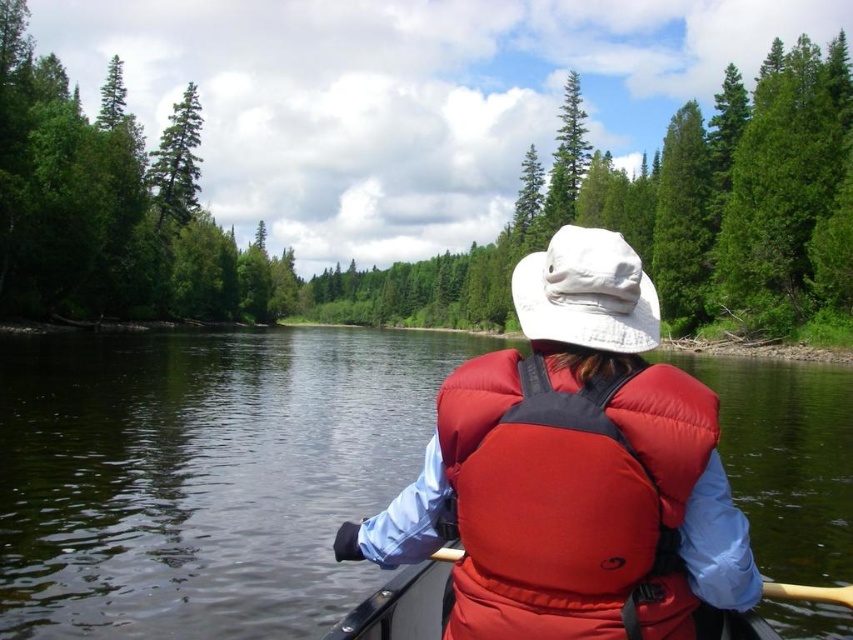
Is rubberized red canoe at center bigger than wooden paddle at center?

Actually, rubberized red canoe at center might be smaller than wooden paddle at center.

Image resolution: width=853 pixels, height=640 pixels. I want to click on rubberized red canoe at center, so click(401, 604).

From the picture: Which is more to the left, dark green water at center or red matte life jacket at center?

dark green water at center

From the picture: Which of these two, dark green water at center or red matte life jacket at center, stands taller?

Standing taller between the two is dark green water at center.

Between point (712, 372) and point (508, 467), which one is positioned behind?

Point (712, 372)

Locate an element on the screen. The width and height of the screenshot is (853, 640). dark green water at center is located at coordinates (202, 474).

Where is `green matte tree at upper left`? This screenshot has height=640, width=853. green matte tree at upper left is located at coordinates (177, 161).

Describe the element at coordinates (177, 161) in the screenshot. I see `green matte tree at upper left` at that location.

Find the location of `green matte tree at upper left`. green matte tree at upper left is located at coordinates pos(177,161).